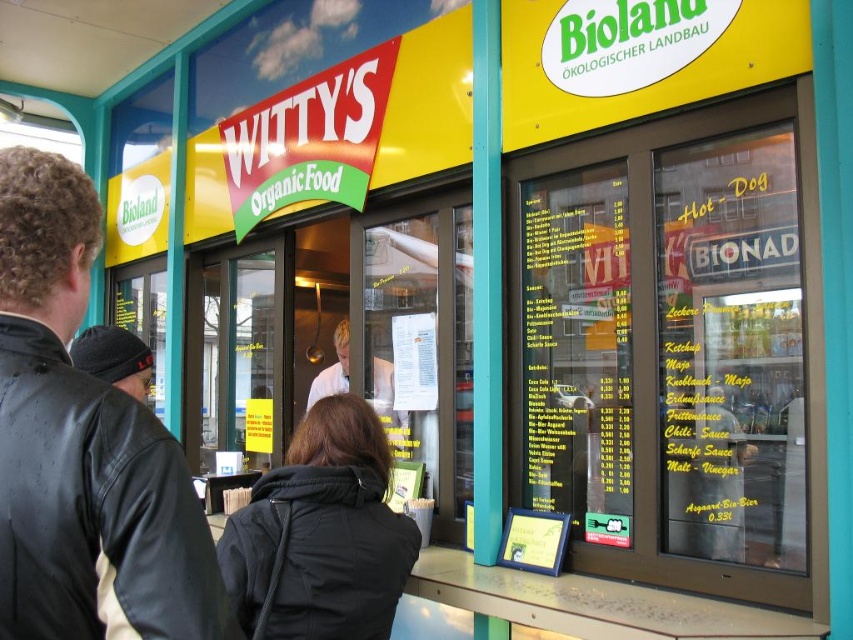
Question: Which of the following is the farthest from the observer?

Choices:
 (A) white uniform at center
 (B) white paper menu at center
 (C) leather jacket at left

Answer: (A)

Question: Which point appears farthest from the camera in this image?

Choices:
 (A) (291, 612)
 (B) (393, 417)
 (C) (397, 362)
 (D) (99, 388)

Answer: (B)

Question: Is leather jacket at left positioned behind white uniform at center?

Choices:
 (A) yes
 (B) no

Answer: (B)

Question: Is the position of black fabric jacket at center more distant than that of white paper menu at center?

Choices:
 (A) no
 (B) yes

Answer: (A)

Question: Estimate the real-world distances between objects in this image. Which object is farther from the white uniform at center?

Choices:
 (A) leather jacket at left
 (B) white paper menu at center
 (C) black fabric jacket at center

Answer: (A)

Question: Does leather jacket at left come behind white uniform at center?

Choices:
 (A) no
 (B) yes

Answer: (A)